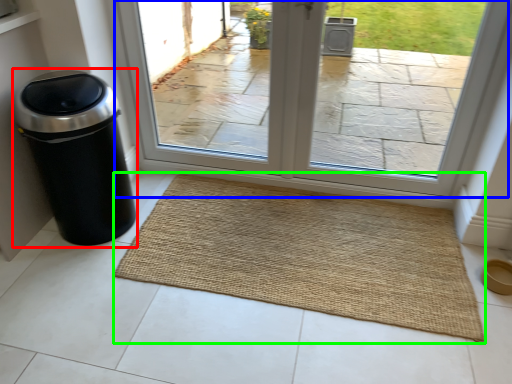
Question: Estimate the real-world distances between objects in this image. Which object is farther from waste container (highlighted by a red box), window (highlighted by a blue box) or mat (highlighted by a green box)?

Choices:
 (A) window
 (B) mat

Answer: (A)